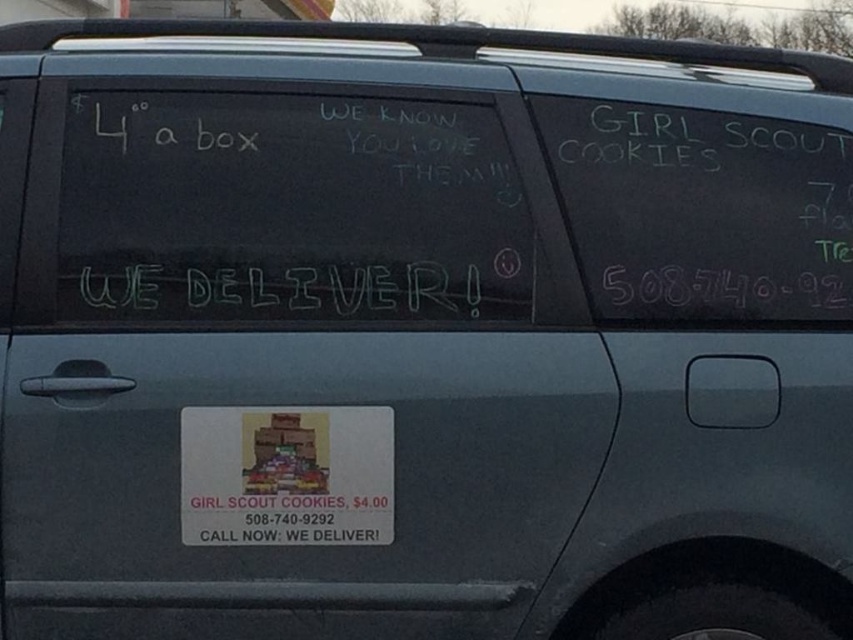
Is white chalkboard at center further to camera compared to white chalk writing at center?

That is False.

Is white chalkboard at center wider than white chalk writing at center?

Indeed, white chalkboard at center has a greater width compared to white chalk writing at center.

Identify the location of white chalkboard at center. The image size is (853, 640). click(x=289, y=211).